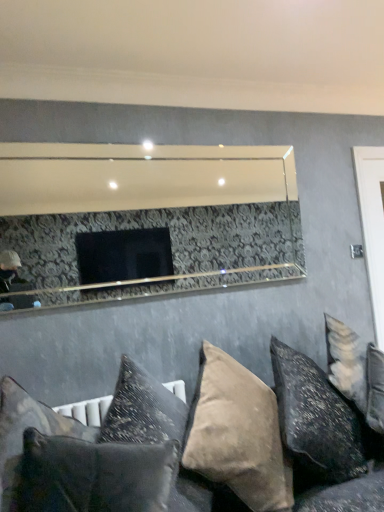
Question: From the image's perspective, is velvet dark gray pillow at lower left, the fifth pillow when ordered from right to left, above or below velvet beige pillow at lower right, arranged as the 5th pillow when viewed from the left?

Choices:
 (A) below
 (B) above

Answer: (A)

Question: Is point (13, 385) closer or farther from the camera than point (304, 464)?

Choices:
 (A) farther
 (B) closer

Answer: (A)

Question: Estimate the real-world distances between objects in this image. Which object is farther from the white glossy door at right?

Choices:
 (A) clear glass mirror at upper center
 (B) velvet cushions at lower center
 (C) textured gray pillow at lower center, acting as the fourth pillow starting from the right
 (D) velvet dark gray pillow at lower left, the fifth pillow when ordered from right to left
 (E) suede-like beige pillow at lower center, which is counted as the third pillow, starting from the left

Answer: (A)

Question: Which object is the closest to the velvet dark gray pillow at lower left, acting as the first pillow starting from the left?

Choices:
 (A) velvet cushions at lower center
 (B) suede-like beige pillow at lower center, which is counted as the third pillow, starting from the left
 (C) clear glass mirror at upper center
 (D) velvet beige pillow at lower right, arranged as the 5th pillow when viewed from the left
 (E) white glossy door at right

Answer: (B)